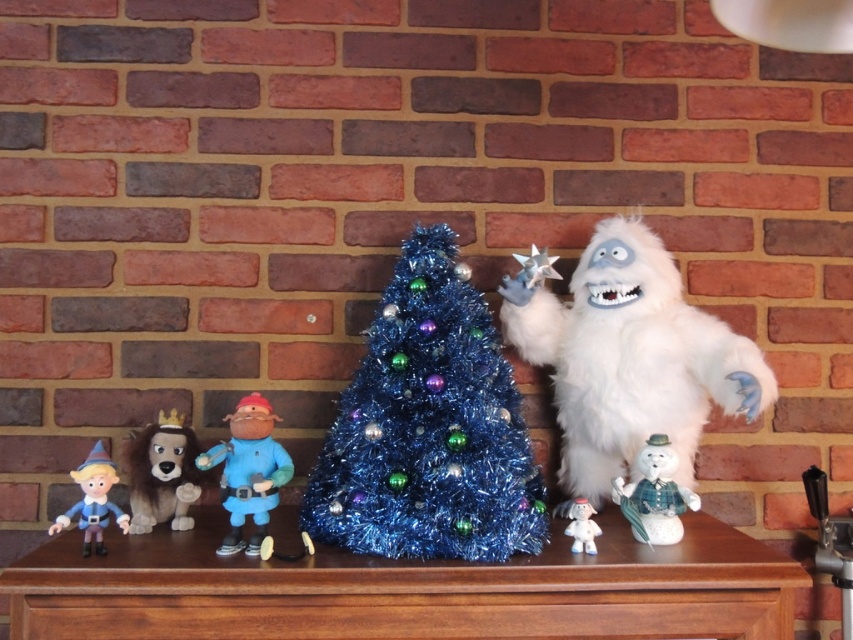
Question: Which object is positioned closest to the white fluffy ghost at right?

Choices:
 (A) brown wooden table at center
 (B) matte blue figurine at lower left

Answer: (A)

Question: Which point is farther from the camera taking this photo?

Choices:
 (A) (654, 458)
 (B) (80, 628)

Answer: (A)

Question: Can you confirm if shiny blue tinsel at center is thinner than white fluffy doll at lower center?

Choices:
 (A) no
 (B) yes

Answer: (A)

Question: Which of these objects is positioned farthest from the blue matte figure at center?

Choices:
 (A) brown wooden table at center
 (B) brown plush toy at left
 (C) white fluffy ghost at right
 (D) shiny blue tinsel at center

Answer: (C)

Question: Does shiny blue tinsel at center lie behind matte blue figurine at lower left?

Choices:
 (A) no
 (B) yes

Answer: (A)

Question: Observing the image, what is the correct spatial positioning of blue matte figure at center in reference to white fluffy doll at lower center?

Choices:
 (A) above
 (B) below

Answer: (A)